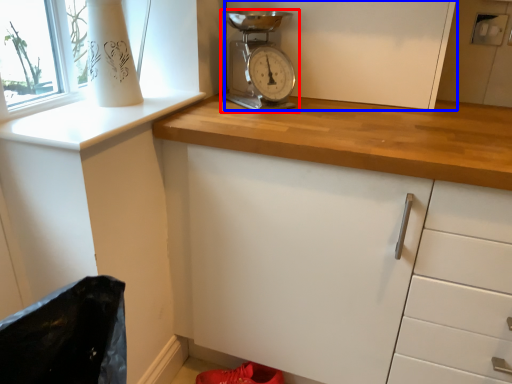
Question: Which of the following is the closest to the observer, home appliance (highlighted by a red box) or cabinetry (highlighted by a blue box)?

Choices:
 (A) home appliance
 (B) cabinetry

Answer: (A)